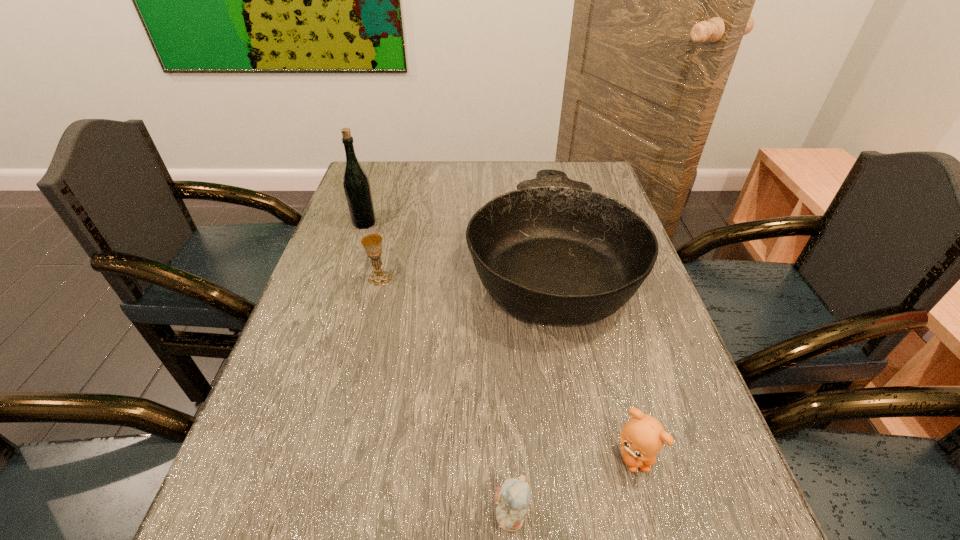
Locate an element on the screen. free area in between the fourth object from right to left and the frying pan is located at coordinates (465, 269).

At what (x,y) coordinates should I click in order to perform the action: click on vacant space in between the fourth object from right to left and the right teddy bear. Please return your answer as a coordinate pair (x, y). The width and height of the screenshot is (960, 540). Looking at the image, I should click on (507, 367).

Select which object is the closest to the right teddy bear. Please provide its 2D coordinates. Your answer should be formatted as a tuple, i.e. [(x, y)], where the tuple contains the x and y coordinates of a point satisfying the conditions above.

[(513, 497)]

Point out which object is positioned as the nearest to the right teddy bear. Please provide its 2D coordinates. Your answer should be formatted as a tuple, i.e. [(x, y)], where the tuple contains the x and y coordinates of a point satisfying the conditions above.

[(513, 497)]